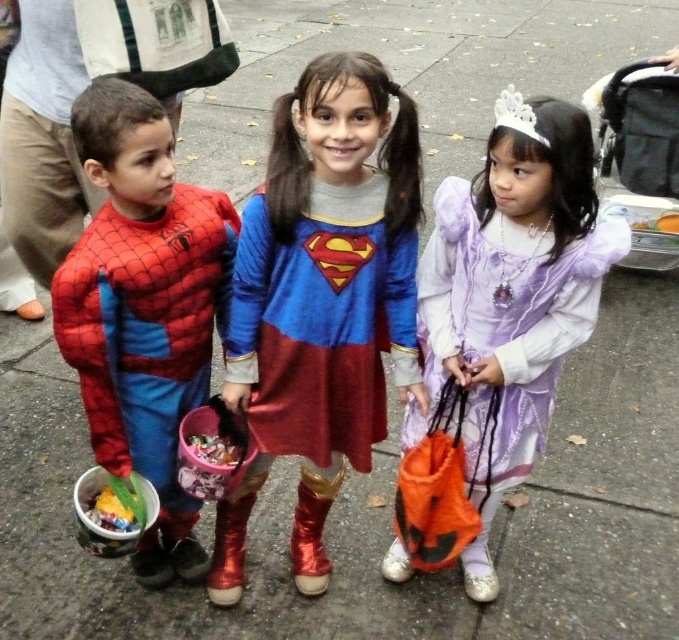
You are a photographer trying to capture a group photo of the shiny blue dress at center and the shiny spandex suit at left. Since you want to ensure both subjects are in focus, you need to know their sizes. Which one is larger?

The shiny blue dress at center is bigger than the shiny spandex suit at left, so you should adjust your camera settings to accommodate the larger size of the shiny blue dress at center for better focus.

You are a photographer trying to capture a group photo of the shiny blue dress at center and the purple satin dress at center. Which dress should you position closer to the camera to ensure both appear equally wide in the photo?

You should position the purple satin dress at center closer to the camera because the shiny blue dress at center might be wider than the purple satin dress at center. This adjustment will help both dresses appear equally wide in the photo.

Consider the image. You are a photographer trying to capture a group photo of the shiny blue dress at center and the shiny spandex suit at left. The minimum distance required between the two subjects for your camera to focus properly is 10 inches. Based on the scene, will the camera be able to focus on both subjects simultaneously?

The shiny blue dress at center and the shiny spandex suit at left are 8.37 inches apart from each other. Since this distance is less than the required 10 inches, the camera may struggle to focus on both subjects simultaneously.